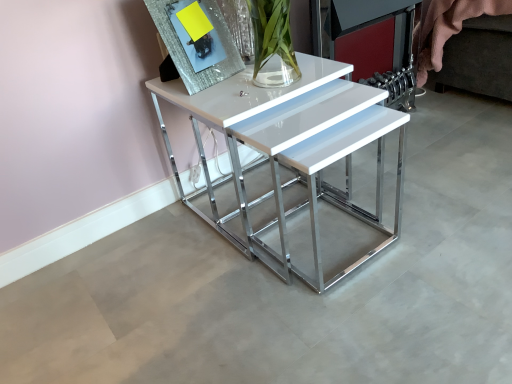
Question: Can you confirm if sparkly silver picture frame at upper left is positioned to the left of white glossy table at center?

Choices:
 (A) yes
 (B) no

Answer: (A)

Question: Is the position of sparkly silver picture frame at upper left less distant than that of white glossy table at center?

Choices:
 (A) no
 (B) yes

Answer: (A)

Question: From the image's perspective, is sparkly silver picture frame at upper left on white glossy table at center?

Choices:
 (A) yes
 (B) no

Answer: (A)

Question: Does sparkly silver picture frame at upper left have a smaller size compared to white glossy table at center?

Choices:
 (A) no
 (B) yes

Answer: (B)

Question: Does sparkly silver picture frame at upper left turn towards white glossy table at center?

Choices:
 (A) no
 (B) yes

Answer: (A)

Question: Would you say sparkly silver picture frame at upper left is a long distance from white glossy table at center?

Choices:
 (A) no
 (B) yes

Answer: (A)

Question: Is white glossy table at center further to the viewer compared to sparkly silver picture frame at upper left?

Choices:
 (A) yes
 (B) no

Answer: (B)

Question: Does white glossy table at center have a greater height compared to sparkly silver picture frame at upper left?

Choices:
 (A) no
 (B) yes

Answer: (B)

Question: Is white glossy table at center far away from sparkly silver picture frame at upper left?

Choices:
 (A) yes
 (B) no

Answer: (B)

Question: Does white glossy table at center appear on the right side of sparkly silver picture frame at upper left?

Choices:
 (A) no
 (B) yes

Answer: (B)

Question: Can you see white glossy table at center touching sparkly silver picture frame at upper left?

Choices:
 (A) yes
 (B) no

Answer: (B)

Question: From a real-world perspective, is white glossy table at center over sparkly silver picture frame at upper left?

Choices:
 (A) no
 (B) yes

Answer: (A)

Question: From the image's perspective, is sparkly silver picture frame at upper left located above or below white glossy table at center?

Choices:
 (A) below
 (B) above

Answer: (B)